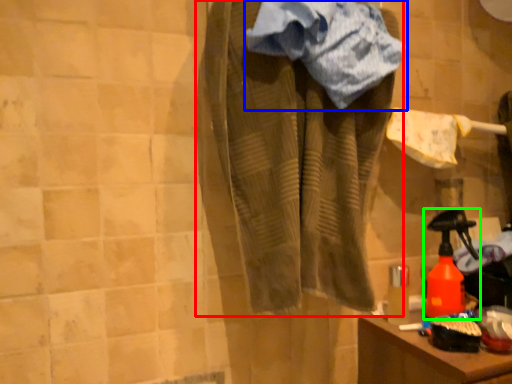
Question: Which is nearer to the clothing (highlighted by a red box)? towel (highlighted by a blue box) or bottle (highlighted by a green box).

Choices:
 (A) towel
 (B) bottle

Answer: (A)